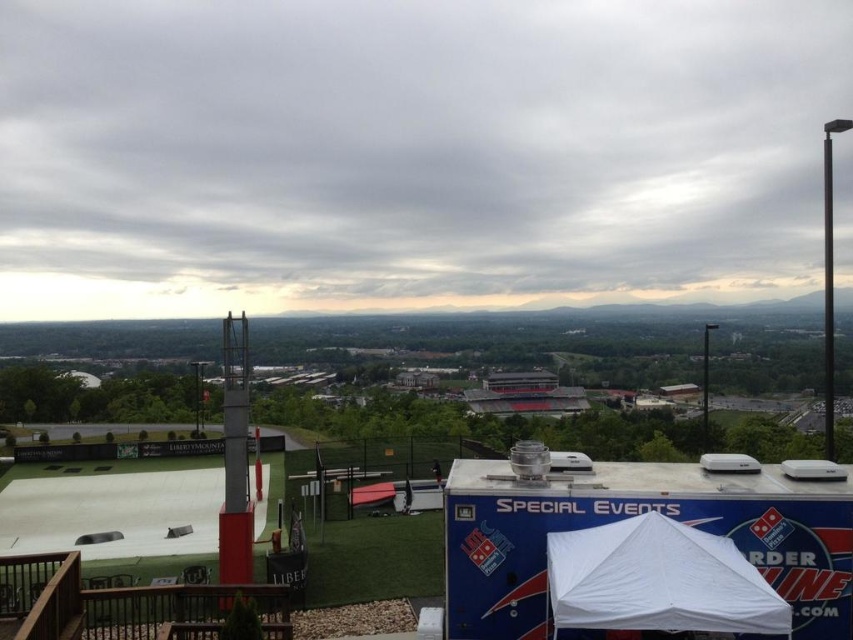
Is red brick stadium at center wider than white fabric canopy at lower right?

Correct, the width of red brick stadium at center exceeds that of white fabric canopy at lower right.

Who is more distant from viewer, (x=450, y=560) or (x=590, y=536)?

The point (x=450, y=560) is more distant.

In order to click on red brick stadium at center in this screenshot , I will do `click(631, 516)`.